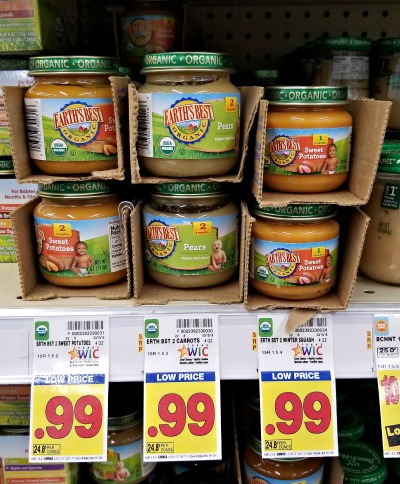
Identify the location of back of the shelf. The height and width of the screenshot is (484, 400). (258, 23).